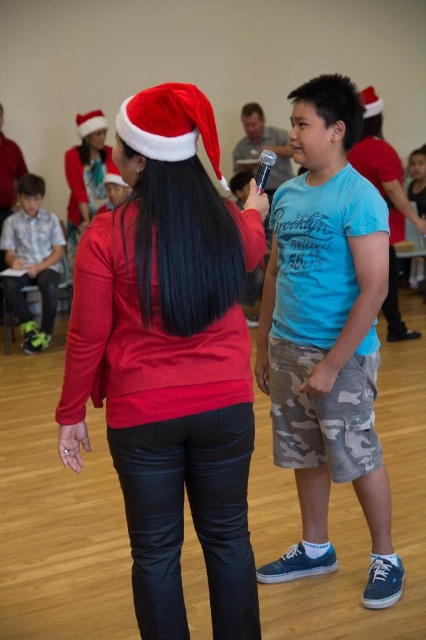
Question: Observing the image, what is the correct spatial positioning of camo shorts at center in reference to red santa hat at upper left?

Choices:
 (A) below
 (B) above

Answer: (A)

Question: Which point appears closest to the camera in this image?

Choices:
 (A) (172, 150)
 (B) (100, 129)
 (C) (376, 115)
 (D) (409, 332)

Answer: (A)

Question: Can you confirm if red felt santa hat at upper left is wider than red santa hat at upper center?

Choices:
 (A) no
 (B) yes

Answer: (B)

Question: Is plaid shirt at left below red santa hat at upper center?

Choices:
 (A) no
 (B) yes

Answer: (B)

Question: Among these objects, which one is nearest to the camera?

Choices:
 (A) metallic silver microphone at upper center
 (B) red santa hat at upper left
 (C) red felt santa hat at upper left

Answer: (C)

Question: Which object is farther from the camera taking this photo?

Choices:
 (A) matte red santa hat at upper center
 (B) red santa hat at upper left

Answer: (B)